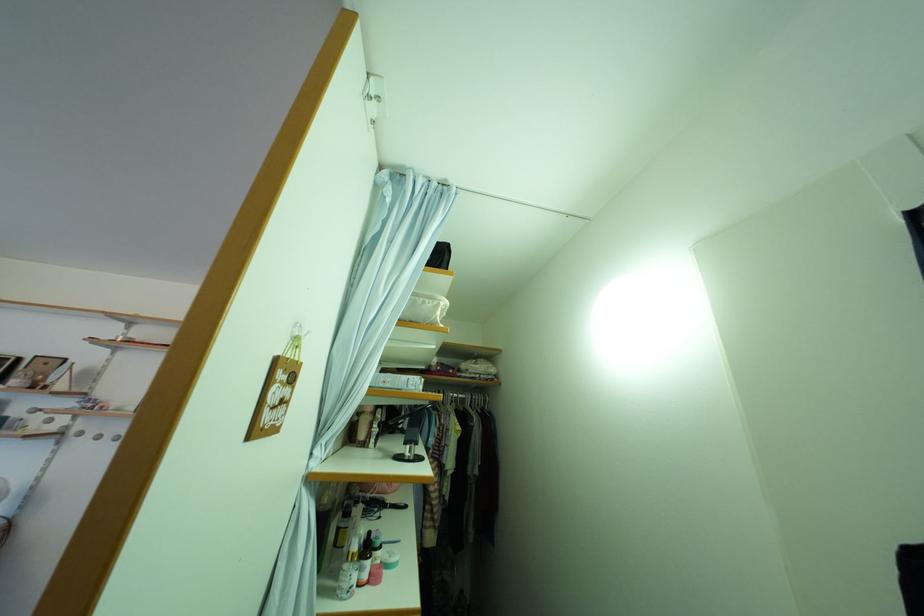
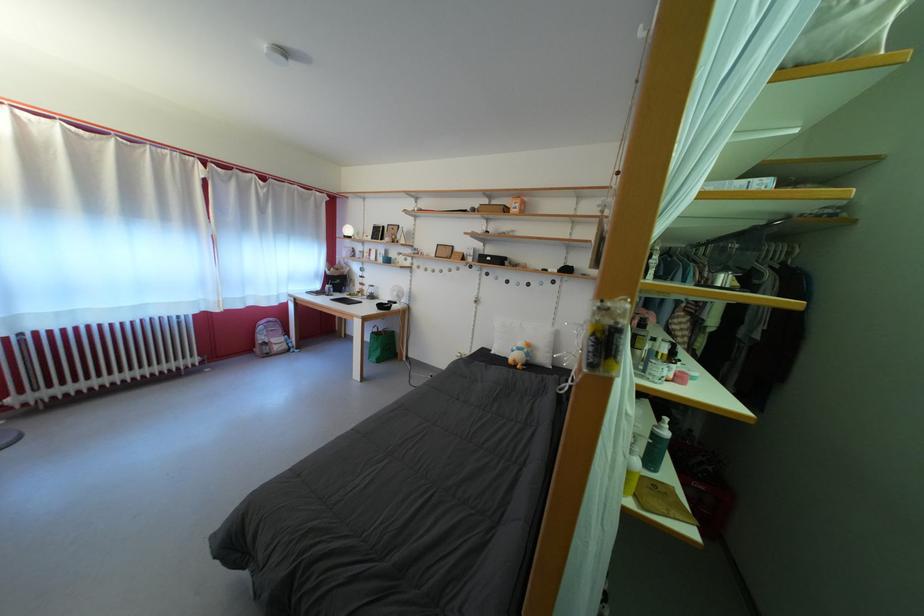
How did the camera likely rotate?

The camera rotated toward left-down.